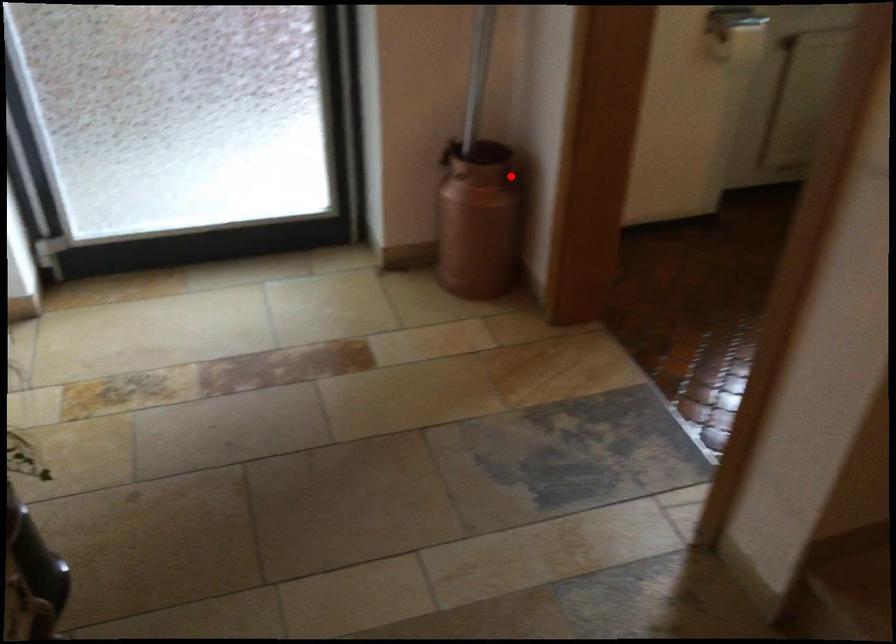
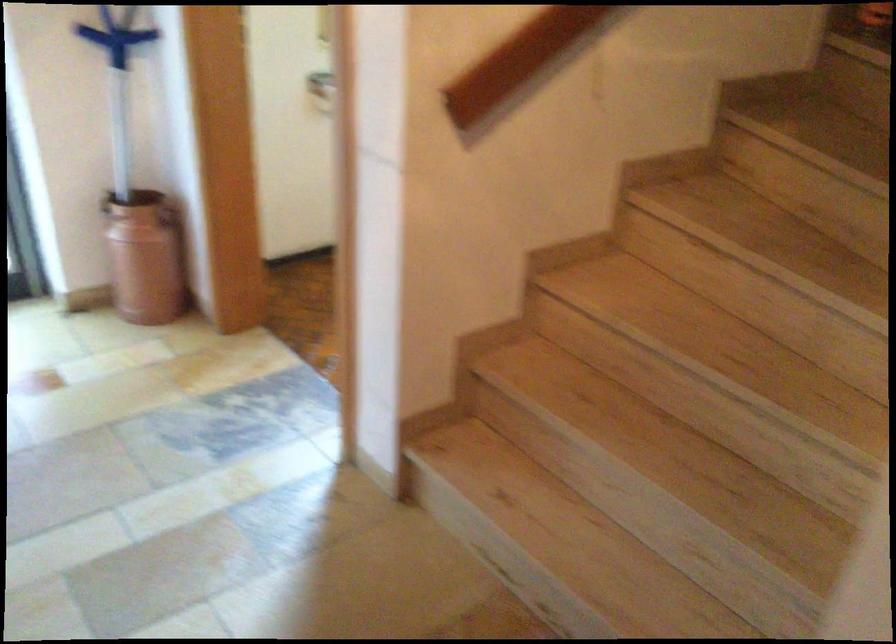
Where in the second image is the point corresponding to the highlighted location from the first image?

(168, 216)